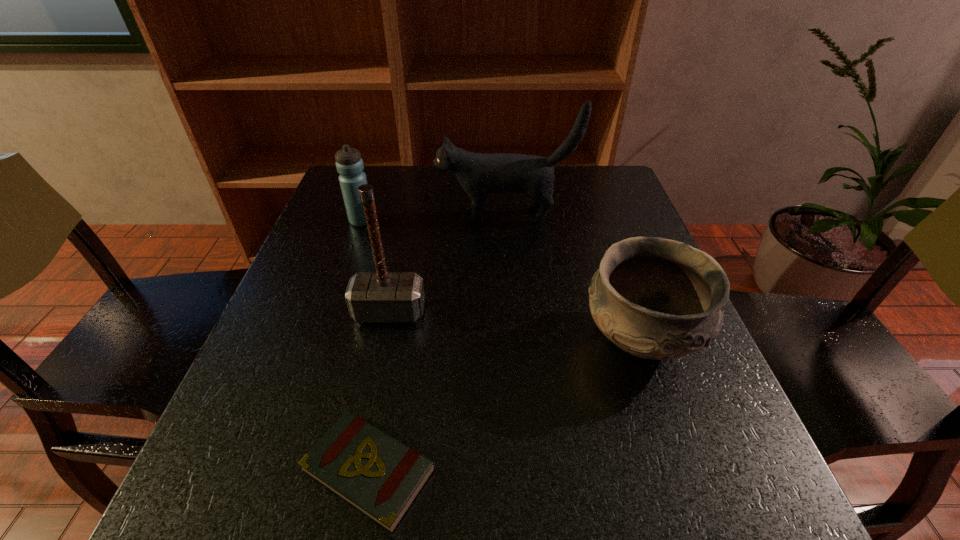
This screenshot has height=540, width=960. I want to click on vacant space located on the striking surface of the hammer, so click(x=381, y=352).

Find the location of a particular element. vacant region located on the right of the leftmost object is located at coordinates (530, 221).

This screenshot has width=960, height=540. Identify the location of free space located on the back of the fourth tallest object. (589, 194).

This screenshot has width=960, height=540. Find the location of `vacant space located on the back of the book`. vacant space located on the back of the book is located at coordinates (384, 390).

Locate an element on the screen. Image resolution: width=960 pixels, height=540 pixels. object located at the far edge is located at coordinates (479, 174).

You are a GUI agent. You are given a task and a screenshot of the screen. Output one action in this format:
    pyautogui.click(x=<x>, y=<y>)
    Task: Click on the object that is at the near edge
    This screenshot has height=540, width=960.
    Given the screenshot: What is the action you would take?
    pyautogui.click(x=379, y=476)

Locate an element on the screen. The height and width of the screenshot is (540, 960). hammer that is at the left edge is located at coordinates pyautogui.click(x=381, y=296).

Where is `water bottle present at the left edge`? water bottle present at the left edge is located at coordinates (349, 164).

The height and width of the screenshot is (540, 960). In order to click on book located at the left edge in this screenshot , I will do `click(379, 476)`.

The image size is (960, 540). Find the location of `object that is at the right edge`. object that is at the right edge is located at coordinates (655, 298).